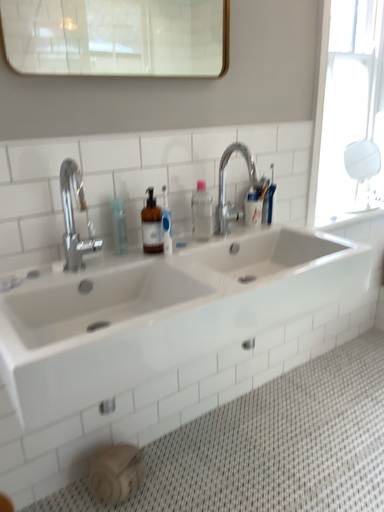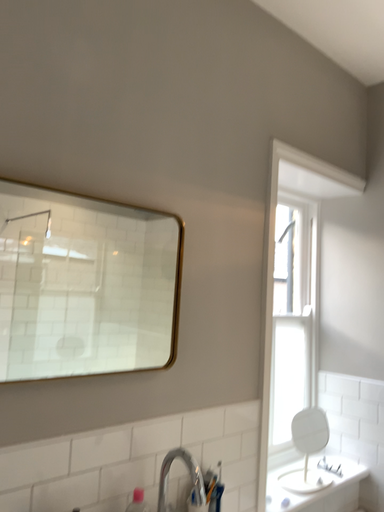
Question: How did the camera likely rotate when shooting the video?

Choices:
 (A) rotated downward
 (B) rotated upward

Answer: (B)